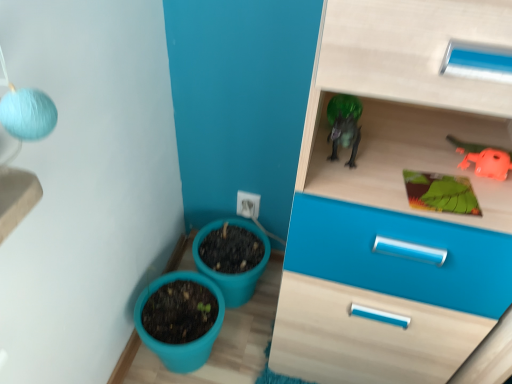
Find the location of `green matte board at upper right`. green matte board at upper right is located at coordinates (440, 193).

Image resolution: width=512 pixels, height=384 pixels. What do you see at coordinates (232, 274) in the screenshot?
I see `matte plastic flowerpot at lower center, the second flowerpot in the front-to-back sequence` at bounding box center [232, 274].

Describe the element at coordinates (484, 159) in the screenshot. I see `orange rubber toy at upper right` at that location.

The width and height of the screenshot is (512, 384). I want to click on orange rubber toy at upper right, so click(484, 159).

Identify the location of green matte board at upper right. (440, 193).

Does green matte board at upper right have a larger size compared to orange rubber toy at upper right?

No, green matte board at upper right is not bigger than orange rubber toy at upper right.

Is green matte board at upper right facing away from orange rubber toy at upper right?

green matte board at upper right does not have its back to orange rubber toy at upper right.

Is green matte board at upper right beside orange rubber toy at upper right?

Yes, green matte board at upper right is with orange rubber toy at upper right.

Looking at this image, which object is further away from the camera taking this photo, orange rubber toy at upper right or matte plastic flowerpot at lower center, the second flowerpot in the front-to-back sequence?

matte plastic flowerpot at lower center, the second flowerpot in the front-to-back sequence, is further away from the camera.

What's the angular difference between orange rubber toy at upper right and matte plastic flowerpot at lower center, the second flowerpot in the front-to-back sequence,'s facing directions?

1.41 degrees.

From the image's perspective, is orange rubber toy at upper right over matte plastic flowerpot at lower center, which appears as the 1th flowerpot when viewed from the back?

Yes, from the image's perspective, orange rubber toy at upper right is above matte plastic flowerpot at lower center, which appears as the 1th flowerpot when viewed from the back.

Is orange rubber toy at upper right facing towards matte plastic flowerpot at lower center, the second flowerpot in the front-to-back sequence?

No, orange rubber toy at upper right does not turn towards matte plastic flowerpot at lower center, the second flowerpot in the front-to-back sequence.

Is green matte board at upper right facing away from matte plastic flowerpot at lower center, the second flowerpot in the front-to-back sequence?

green matte board at upper right does not have its back to matte plastic flowerpot at lower center, the second flowerpot in the front-to-back sequence.

From the green matte board at upper right, count 2nd flowerpots backward and point to it. Please provide its 2D coordinates.

[(232, 274)]

Is matte plastic flowerpot at lower center, the second flowerpot in the front-to-back sequence, completely or partially inside green matte board at upper right?

No, green matte board at upper right does not contain matte plastic flowerpot at lower center, the second flowerpot in the front-to-back sequence.

Are teal plastic flowerpot at lower left, marked as the 2th flowerpot in a back-to-front arrangement, and matte plastic flowerpot at lower center, which appears as the 1th flowerpot when viewed from the back, located far from each other?

No, there isn't a large distance between teal plastic flowerpot at lower left, marked as the 2th flowerpot in a back-to-front arrangement, and matte plastic flowerpot at lower center, which appears as the 1th flowerpot when viewed from the back.

Does teal plastic flowerpot at lower left, which is the first flowerpot in front-to-back order, have a lesser width compared to matte plastic flowerpot at lower center, the second flowerpot in the front-to-back sequence?

Correct, the width of teal plastic flowerpot at lower left, which is the first flowerpot in front-to-back order, is less than that of matte plastic flowerpot at lower center, the second flowerpot in the front-to-back sequence.

Is point (213, 290) farther from camera compared to point (193, 255)?

No, it is not.

Looking at this image, from a real-world perspective, which object rests below the other?

From a 3D spatial view, matte plastic flowerpot at lower center, which appears as the 1th flowerpot when viewed from the back, is below.

Considering the sizes of objects matte plastic flowerpot at lower center, the second flowerpot in the front-to-back sequence, and green matte board at upper right in the image provided, who is shorter, matte plastic flowerpot at lower center, the second flowerpot in the front-to-back sequence, or green matte board at upper right?

Standing shorter between the two is green matte board at upper right.

You are a GUI agent. You are given a task and a screenshot of the screen. Output one action in this format:
    pyautogui.click(x=<x>, y=<y>)
    Task: Click on the plant in front of the matte plastic flowerpot at lower center, the second flowerpot in the front-to-back sequence
    The width and height of the screenshot is (512, 384).
    Given the screenshot: What is the action you would take?
    pyautogui.click(x=440, y=193)

From the image's perspective, between matte plastic flowerpot at lower center, the second flowerpot in the front-to-back sequence, and green matte board at upper right, which one is located above?

green matte board at upper right, from the image's perspective.

Is matte plastic flowerpot at lower center, the second flowerpot in the front-to-back sequence, far from green matte board at upper right?

matte plastic flowerpot at lower center, the second flowerpot in the front-to-back sequence, is near green matte board at upper right, not far away.

Considering the relative sizes of orange rubber toy at upper right and green matte board at upper right in the image provided, is orange rubber toy at upper right wider than green matte board at upper right?

Yes.

Consider the image. In the image, is orange rubber toy at upper right positioned in front of or behind green matte board at upper right?

orange rubber toy at upper right is positioned farther from the viewer than green matte board at upper right.

In the scene shown: Which point is more forward, [490,148] or [412,194]?

The point [412,194] is closer.

From a real-world perspective, who is located lower, orange rubber toy at upper right or green matte board at upper right?

green matte board at upper right, from a real-world perspective.

Can you confirm if teal plastic flowerpot at lower left, which is the first flowerpot in front-to-back order, is wider than green matte board at upper right?

Correct, the width of teal plastic flowerpot at lower left, which is the first flowerpot in front-to-back order, exceeds that of green matte board at upper right.

Does teal plastic flowerpot at lower left, marked as the 2th flowerpot in a back-to-front arrangement, turn towards green matte board at upper right?

No.

Considering the points (200, 345) and (443, 189), which point is behind, point (200, 345) or point (443, 189)?

The point (200, 345) is more distant.

From the picture: Is teal plastic flowerpot at lower left, marked as the 2th flowerpot in a back-to-front arrangement, taller than green matte board at upper right?

Yes, teal plastic flowerpot at lower left, marked as the 2th flowerpot in a back-to-front arrangement, is taller than green matte board at upper right.

This screenshot has width=512, height=384. Identify the location of plant on the left of orange rubber toy at upper right. (440, 193).

There is a matte plastic flowerpot at lower center, which appears as the 1th flowerpot when viewed from the back. In order to click on toy above it (from a real-world perspective) in this screenshot , I will do `click(484, 159)`.

Consider the image. Considering their positions, is orange rubber toy at upper right positioned further to teal plastic flowerpot at lower left, which is the first flowerpot in front-to-back order, than green matte board at upper right?

orange rubber toy at upper right is further to teal plastic flowerpot at lower left, which is the first flowerpot in front-to-back order.

Based on their spatial positions, is matte plastic flowerpot at lower center, which appears as the 1th flowerpot when viewed from the back, or teal plastic flowerpot at lower left, which is the first flowerpot in front-to-back order, closer to green matte board at upper right?

Among the two, matte plastic flowerpot at lower center, which appears as the 1th flowerpot when viewed from the back, is located nearer to green matte board at upper right.

From the image, which object appears to be nearer to matte plastic flowerpot at lower center, the second flowerpot in the front-to-back sequence, green matte board at upper right or orange rubber toy at upper right?

green matte board at upper right is positioned closer to the anchor matte plastic flowerpot at lower center, the second flowerpot in the front-to-back sequence.

Considering their positions, is orange rubber toy at upper right positioned further to matte plastic flowerpot at lower center, which appears as the 1th flowerpot when viewed from the back, than green matte board at upper right?

The object further to matte plastic flowerpot at lower center, which appears as the 1th flowerpot when viewed from the back, is orange rubber toy at upper right.

Considering their positions, is orange rubber toy at upper right positioned closer to matte plastic flowerpot at lower center, which appears as the 1th flowerpot when viewed from the back, than teal plastic flowerpot at lower left, marked as the 2th flowerpot in a back-to-front arrangement?

Among the two, teal plastic flowerpot at lower left, marked as the 2th flowerpot in a back-to-front arrangement, is located nearer to matte plastic flowerpot at lower center, which appears as the 1th flowerpot when viewed from the back.

Estimate the real-world distances between objects in this image. Which object is closer to teal plastic flowerpot at lower left, which is the first flowerpot in front-to-back order, matte plastic flowerpot at lower center, the second flowerpot in the front-to-back sequence, or green matte board at upper right?

Among the two, matte plastic flowerpot at lower center, the second flowerpot in the front-to-back sequence, is located nearer to teal plastic flowerpot at lower left, which is the first flowerpot in front-to-back order.

Which object lies nearer to the anchor point green matte board at upper right, orange rubber toy at upper right or teal plastic flowerpot at lower left, which is the first flowerpot in front-to-back order?

Among the two, orange rubber toy at upper right is located nearer to green matte board at upper right.

Considering their positions, is teal plastic flowerpot at lower left, which is the first flowerpot in front-to-back order, positioned further to green matte board at upper right than orange rubber toy at upper right?

teal plastic flowerpot at lower left, which is the first flowerpot in front-to-back order.

Locate an element on the screen. flowerpot situated between teal plastic flowerpot at lower left, which is the first flowerpot in front-to-back order, and orange rubber toy at upper right from left to right is located at coordinates (232, 274).

The image size is (512, 384). Find the location of `plant located between teal plastic flowerpot at lower left, marked as the 2th flowerpot in a back-to-front arrangement, and orange rubber toy at upper right in the left-right direction`. plant located between teal plastic flowerpot at lower left, marked as the 2th flowerpot in a back-to-front arrangement, and orange rubber toy at upper right in the left-right direction is located at coordinates (440, 193).

You are a GUI agent. You are given a task and a screenshot of the screen. Output one action in this format:
    pyautogui.click(x=<x>, y=<y>)
    Task: Click on the flowerpot situated between teal plastic flowerpot at lower left, which is the first flowerpot in front-to-back order, and green matte board at upper right from left to right
    
    Given the screenshot: What is the action you would take?
    pyautogui.click(x=232, y=274)

At what (x,y) coordinates should I click in order to perform the action: click on plant located between matte plastic flowerpot at lower center, which appears as the 1th flowerpot when viewed from the back, and orange rubber toy at upper right in the left-right direction. Please return your answer as a coordinate pair (x, y). The image size is (512, 384). Looking at the image, I should click on (440, 193).